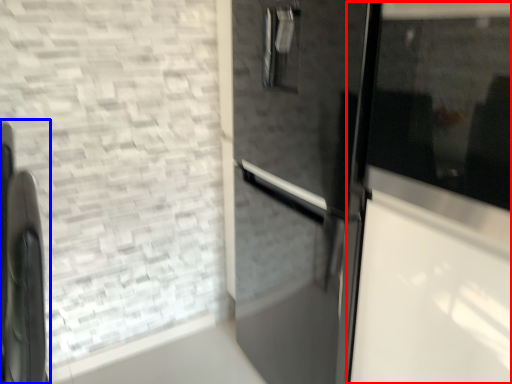
Question: Which of the following is the farthest to the observer, glass door (highlighted by a red box) or appliance (highlighted by a blue box)?

Choices:
 (A) glass door
 (B) appliance

Answer: (B)